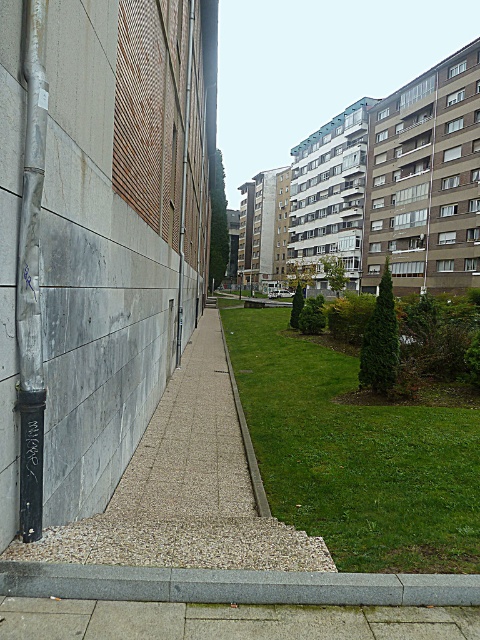
You are standing at the point marked as point (x=228, y=620) in the image. What type of surface are you currently standing on?

The point (x=228, y=620) indicates gray concrete pavement at lower center.

You are a delivery person trying to navigate through the narrow pedestrian pathway in the urban scene. You need to avoid stepping on the green grass at center. Which direction should you walk to stay on the smooth concrete path at center?

The green grass at center is above the smooth concrete path at center, so you should walk below the green grass at center to stay on the smooth concrete path at center.

You are a delivery person with a cart that is 3 feet wide. You need to navigate through the narrow pedestrian pathway. Can your cart fit between the gray concrete pavement at lower center and the gray gravel at lower center?

The gray concrete pavement at lower center and gray gravel at lower center are 30.42 inches apart from each other. Since 30.42 inches is equal to 2.535 feet, which is less than the cart width of 3 feet, the cart cannot fit between them.